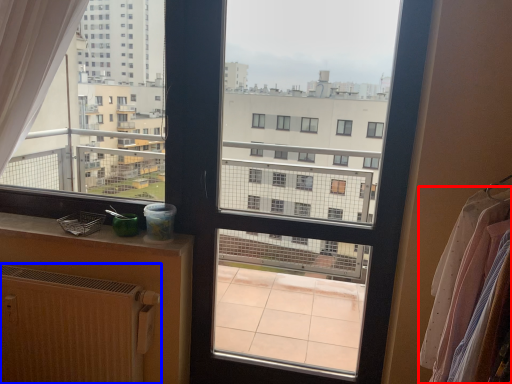
Question: Which of the following is the closest to the observer, clothing (highlighted by a red box) or radiator (highlighted by a blue box)?

Choices:
 (A) clothing
 (B) radiator

Answer: (A)